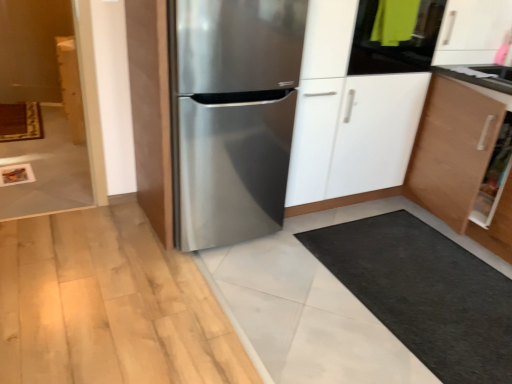
Question: Is stainless steel refrigerator at center to the left of wooden cabinet at left from the viewer's perspective?

Choices:
 (A) yes
 (B) no

Answer: (B)

Question: Is stainless steel refrigerator at center far from wooden cabinet at left?

Choices:
 (A) no
 (B) yes

Answer: (B)

Question: Is stainless steel refrigerator at center bigger than wooden cabinet at left?

Choices:
 (A) no
 (B) yes

Answer: (B)

Question: Can you confirm if stainless steel refrigerator at center is taller than wooden cabinet at left?

Choices:
 (A) yes
 (B) no

Answer: (A)

Question: Is stainless steel refrigerator at center outside of wooden cabinet at left?

Choices:
 (A) no
 (B) yes

Answer: (B)

Question: Is stainless steel refrigerator at center facing away from wooden cabinet at left?

Choices:
 (A) yes
 (B) no

Answer: (A)

Question: Is stainless steel refrigerator at center facing towards stainless steel refrigerator at center?

Choices:
 (A) no
 (B) yes

Answer: (B)

Question: Does stainless steel refrigerator at center have a larger size compared to stainless steel refrigerator at center?

Choices:
 (A) no
 (B) yes

Answer: (B)

Question: Can stainless steel refrigerator at center be found inside stainless steel refrigerator at center?

Choices:
 (A) no
 (B) yes

Answer: (B)

Question: Is stainless steel refrigerator at center closer to the viewer compared to stainless steel refrigerator at center?

Choices:
 (A) no
 (B) yes

Answer: (A)

Question: Is stainless steel refrigerator at center behind stainless steel refrigerator at center?

Choices:
 (A) yes
 (B) no

Answer: (A)

Question: Can you confirm if stainless steel refrigerator at center is positioned to the left of stainless steel refrigerator at center?

Choices:
 (A) no
 (B) yes

Answer: (A)

Question: Considering the relative sizes of wooden cabinet at left and stainless steel refrigerator at center in the image provided, is wooden cabinet at left shorter than stainless steel refrigerator at center?

Choices:
 (A) no
 (B) yes

Answer: (B)